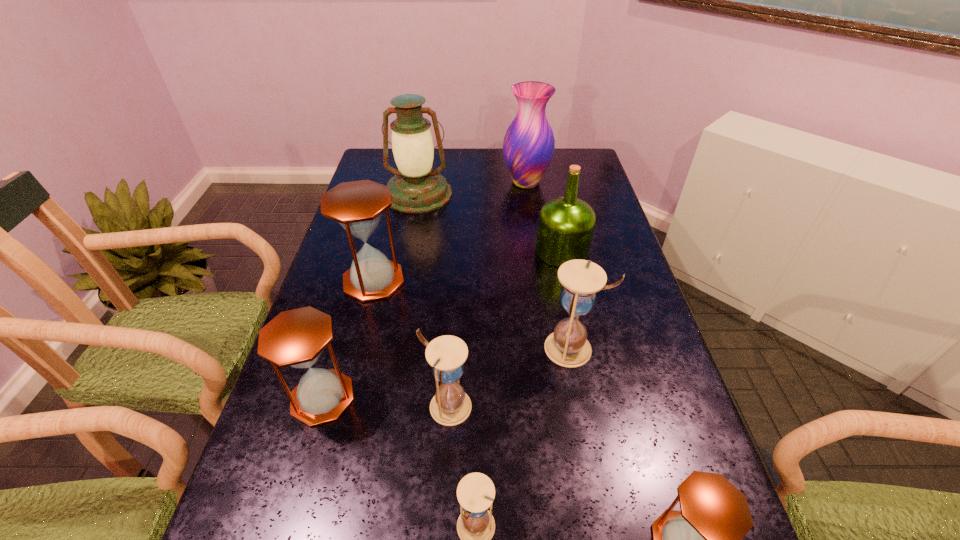
This screenshot has height=540, width=960. What are the coordinates of `white hourglass identified as the second closest to the purple vase` in the screenshot? It's located at (450, 406).

Locate which white hourglass ranks third in proximity to the green olive oil. Please provide its 2D coordinates. Your answer should be formatted as a tuple, i.e. [(x, y)], where the tuple contains the x and y coordinates of a point satisfying the conditions above.

[(475, 492)]

The image size is (960, 540). In order to click on vacant area in the image that satisfies the following two spatial constraints: 1. on the back side of the farthest hourglass; 2. on the left side of the olive oil in this screenshot , I will do 381,251.

Find the location of a particular element. Image resolution: width=960 pixels, height=540 pixels. free space in the image that satisfies the following two spatial constraints: 1. on the back side of the purple vase; 2. on the left side of the second biggest white hourglass is located at coordinates (461, 183).

Where is `vacant space that satisfies the following two spatial constraints: 1. on the back side of the green olive oil; 2. on the left side of the biggest brown hourglass`? Image resolution: width=960 pixels, height=540 pixels. vacant space that satisfies the following two spatial constraints: 1. on the back side of the green olive oil; 2. on the left side of the biggest brown hourglass is located at coordinates (381, 251).